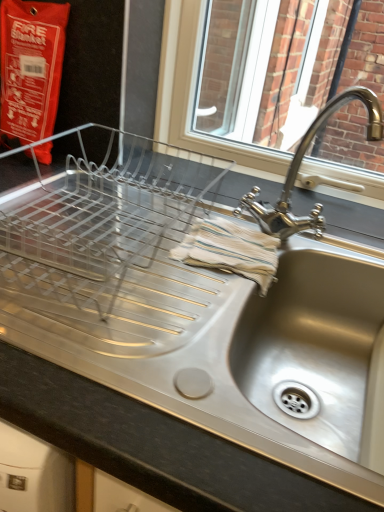
Question: Is point (347, 402) positioned closer to the camera than point (119, 398)?

Choices:
 (A) farther
 (B) closer

Answer: (A)

Question: From the image's perspective, relative to satin steel sink at center, is stainless steel sink at lower right above or below?

Choices:
 (A) below
 (B) above

Answer: (B)

Question: Based on their relative distances, which object is farther from the satin steel sink at center?

Choices:
 (A) polished chrome faucet at upper right
 (B) stainless steel sink at lower right

Answer: (A)

Question: Estimate the real-world distances between objects in this image. Which object is closer to the polished chrome faucet at upper right?

Choices:
 (A) satin steel sink at center
 (B) stainless steel sink at lower right

Answer: (B)